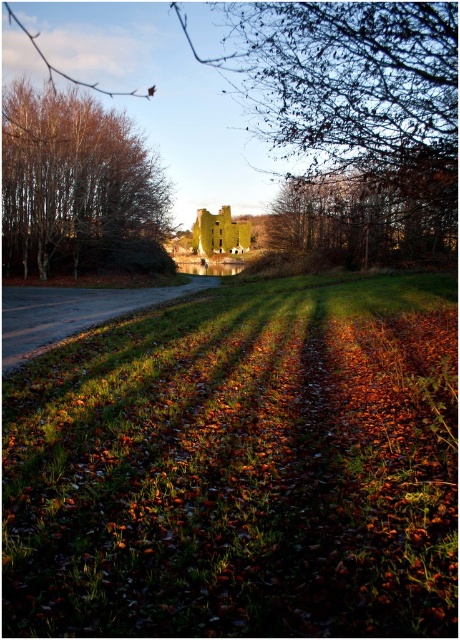
You are a gardener planning to mow the green grass at center and the green stone building at center. Which area requires a wider mower path?

The green stone building at center requires a wider mower path because it has a greater width than the green grass at center.

Consider the image. You are standing at the point closest to the castle in this autumn scene. You want to walk straight towards the castle. Which of the two points, point (x=154, y=349) or point (x=70, y=106), will you pass first?

You will pass point (x=70, y=106) first because it is behind point (x=154, y=349), which is closer to you.

You are standing at the point marked as point (356, 113) in the image. What structure is directly beneath your feet?

The point (356, 113) corresponds to the green stone building at center, so the structure directly beneath your feet is the green stone building at center.